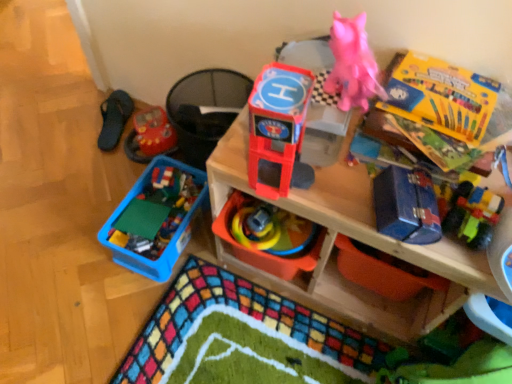
Where is `free area in between blue metallic toolbox at right, placed as the 4th toy when sorted from back to front, and shiny plastic toy helicopter at center, the 5th toy in the back-to-front sequence`? The image size is (512, 384). free area in between blue metallic toolbox at right, placed as the 4th toy when sorted from back to front, and shiny plastic toy helicopter at center, the 5th toy in the back-to-front sequence is located at coordinates (333, 200).